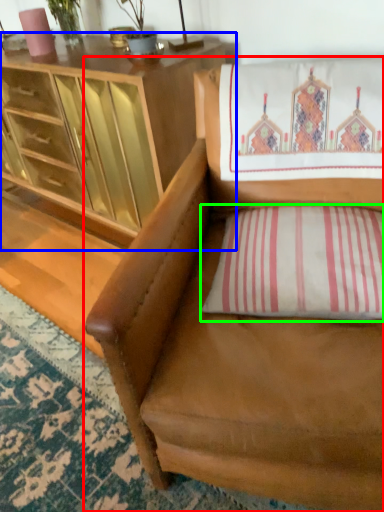
Question: Which object is positioned closest to chair (highlighted by a red box)? Select from cabinetry (highlighted by a blue box) and pillow (highlighted by a green box).

Choices:
 (A) cabinetry
 (B) pillow

Answer: (B)